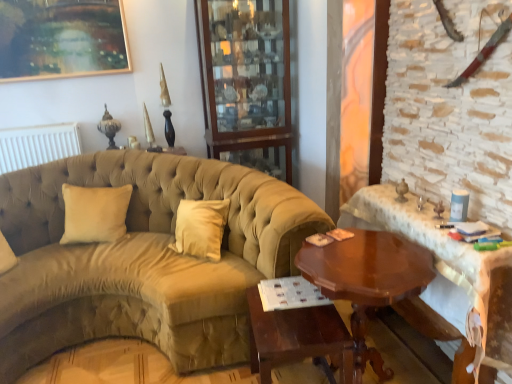
Question: Is beige velvet pillow at left inside the boundaries of suede-like beige couch at center, or outside?

Choices:
 (A) inside
 (B) outside

Answer: (A)

Question: From their relative heights in the image, would you say beige velvet pillow at left is taller or shorter than suede-like beige couch at center?

Choices:
 (A) tall
 (B) short

Answer: (B)

Question: Estimate the real-world distances between objects in this image. Which object is farther from the mahogany wood table at center, which is the 1th table from left to right?

Choices:
 (A) wooden glass cabinet at upper center
 (B) shiny brown wood table at right, which ranks as the third table in left-to-right order
 (C) suede-like beige couch at center
 (D) gold-framed painting at upper left
 (E) beige velvet pillow at left

Answer: (D)

Question: Which is farther from the gold-framed painting at upper left?

Choices:
 (A) suede-like beige couch at center
 (B) beige velvet pillow at left
 (C) mahogany wood table at center, which is the 1th table from left to right
 (D) shiny brown wood table at right, which is the first table in right-to-left order
 (E) wooden glass cabinet at upper center

Answer: (D)